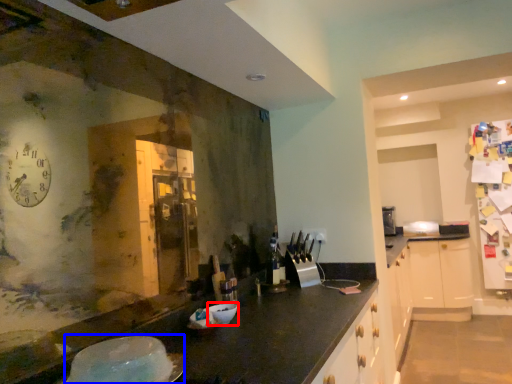
Question: Which of the following is the farthest to the observer, bowl (highlighted by a red box) or appliance (highlighted by a blue box)?

Choices:
 (A) bowl
 (B) appliance

Answer: (A)